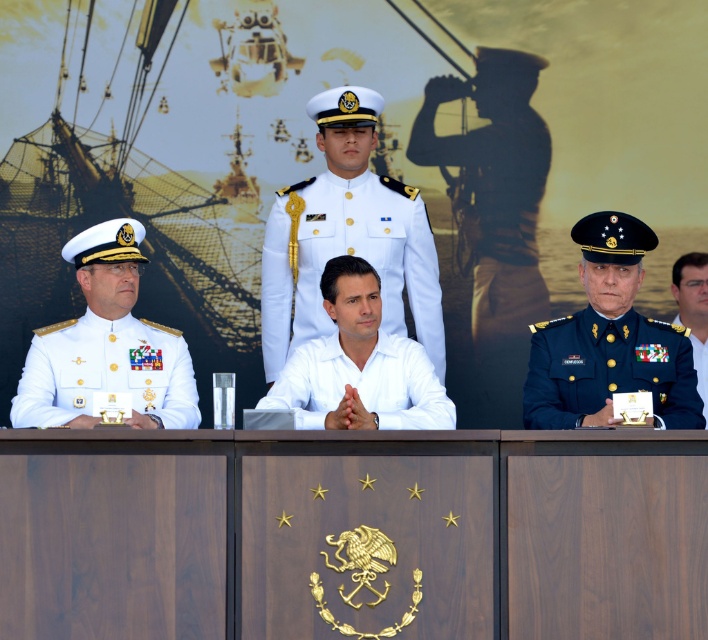
You are an event photographer positioned behind the podium. You need to capture a photo that includes both the white uniform at center and the white matte uniform at left. Which uniform should you position closer to the left side of the frame to ensure both are visible?

The white matte uniform at left should be positioned closer to the left side of the frame since it is already to the left of the white uniform at center.

You are an event photographer positioned in front of the podium. You need to capture a closeup of both the white matte uniform at left and the dark blue fabric military uniform at right. Which uniform should you focus on first to ensure it fits within your camera frame?

The white matte uniform at left is wider than the dark blue fabric military uniform at right, so you should focus on the white matte uniform at left first to ensure it fits within your camera frame.

You are standing in front of the podium. Where exactly is the white matte uniform at left located?

The white matte uniform at left is located at point 0.581 on the x axis and 0.150 on the y axis.